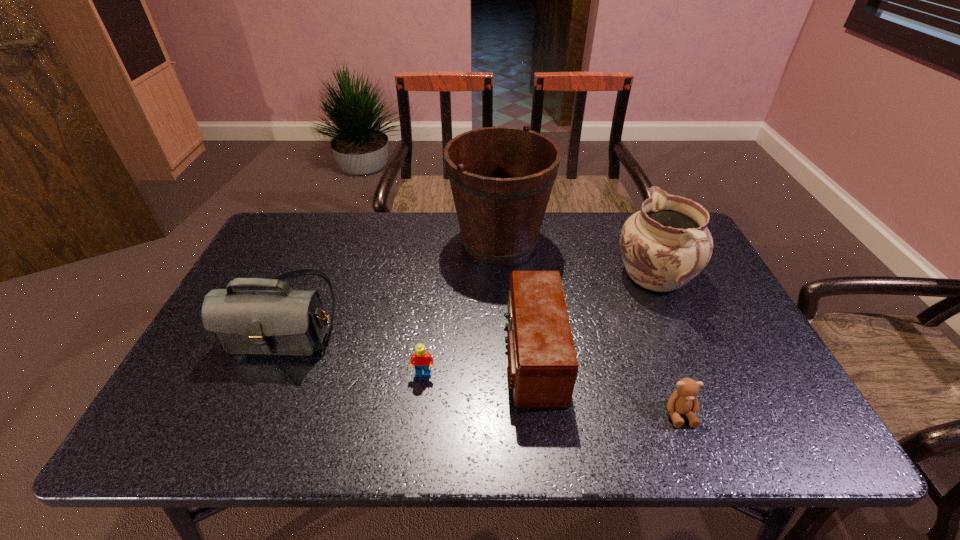
Identify the location of vacant region between the pitcher and the shoulder bag. The height and width of the screenshot is (540, 960). (472, 296).

Locate an element on the screen. Image resolution: width=960 pixels, height=540 pixels. vacant space that is in between the pitcher and the third shortest object is located at coordinates [594, 317].

Where is `free area in between the fourth tallest object and the pitcher`? The width and height of the screenshot is (960, 540). free area in between the fourth tallest object and the pitcher is located at coordinates (594, 317).

You are a GUI agent. You are given a task and a screenshot of the screen. Output one action in this format:
    pyautogui.click(x=<x>, y=<y>)
    Task: Click on the vacant area that lies between the teddy bear and the radio receiver
    The height and width of the screenshot is (540, 960).
    Given the screenshot: What is the action you would take?
    pyautogui.click(x=606, y=384)

This screenshot has height=540, width=960. In order to click on unoccupied area between the shoulder bag and the bucket in this screenshot , I will do `click(395, 278)`.

Find the location of a particular element. The width and height of the screenshot is (960, 540). unoccupied area between the pitcher and the shoulder bag is located at coordinates (472, 296).

Identify which object is the closest to the shoulder bag. Please provide its 2D coordinates. Your answer should be formatted as a tuple, i.e. [(x, y)], where the tuple contains the x and y coordinates of a point satisfying the conditions above.

[(423, 361)]

Locate an element on the screen. This screenshot has width=960, height=540. object identified as the closest to the teddy bear is located at coordinates (542, 364).

Locate an element on the screen. vacant region that satisfies the following two spatial constraints: 1. on the front-facing side of the radio receiver; 2. on the face of the fifth object from right to left is located at coordinates (535, 375).

The height and width of the screenshot is (540, 960). Identify the location of vacant point that satisfies the following two spatial constraints: 1. on the front-facing side of the radio receiver; 2. on the face of the Lego. (535, 375).